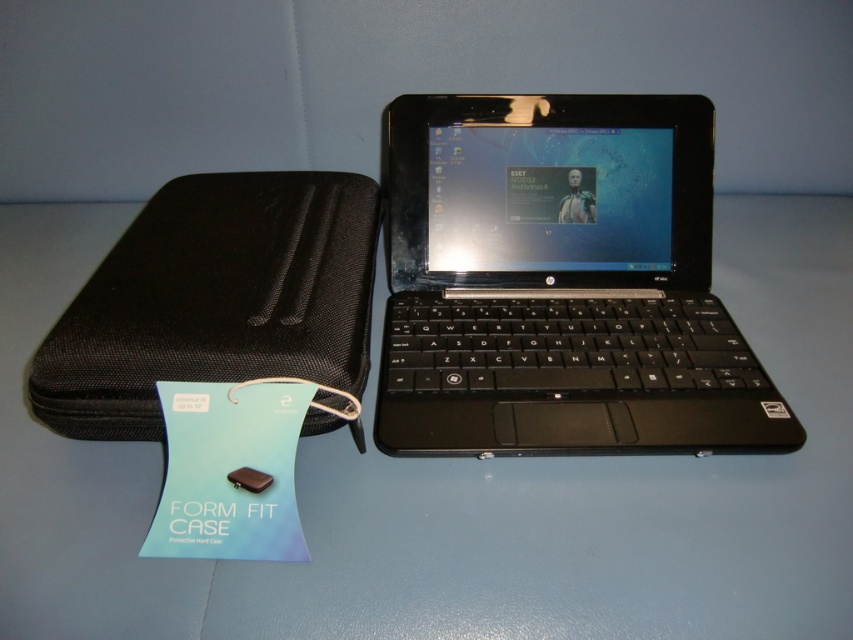
You have a small toy car that is 2 inches long. You want to place it between the blue matte table at center and the black fabric case at left. Is there enough space for the toy car to fit between them?

The blue matte table at center is 7.50 inches from the black fabric case at left, so yes, the toy car that is 2 inches long can fit between them since the distance is greater than the car length.

You are organizing a desk and need to place the black plastic laptop at center and the black fabric case at left. According to the image, which object is positioned higher up?

The black plastic laptop at center is located above the black fabric case at left, so it is positioned higher up.

You are setting up a workspace and have a blue matte table at center and a black fabric case at left. Which object is positioned lower in the scene?

The blue matte table at center is located below the black fabric case at left, so the blue matte table at center is positioned lower in the scene.